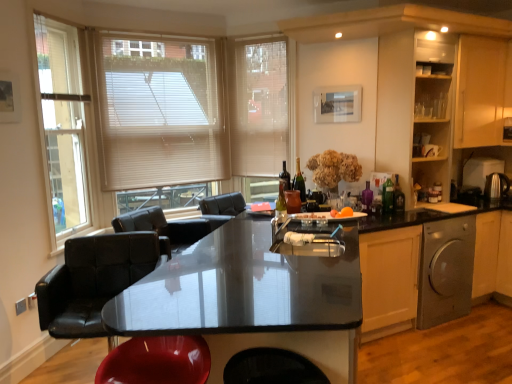
You are a GUI agent. You are given a task and a screenshot of the screen. Output one action in this format:
    pyautogui.click(x=<x>, y=<y>)
    Task: Click on the free location above beige blinds at upper left (from a real-world perspective)
    This screenshot has height=384, width=512.
    Given the screenshot: What is the action you would take?
    pyautogui.click(x=149, y=23)